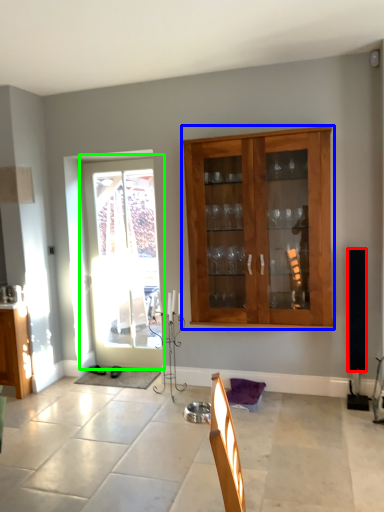
Question: Which object is the farthest from loudspeaker (highlighted by a red box)? Choose among these: cabinet (highlighted by a blue box) or door (highlighted by a green box).

Choices:
 (A) cabinet
 (B) door

Answer: (B)